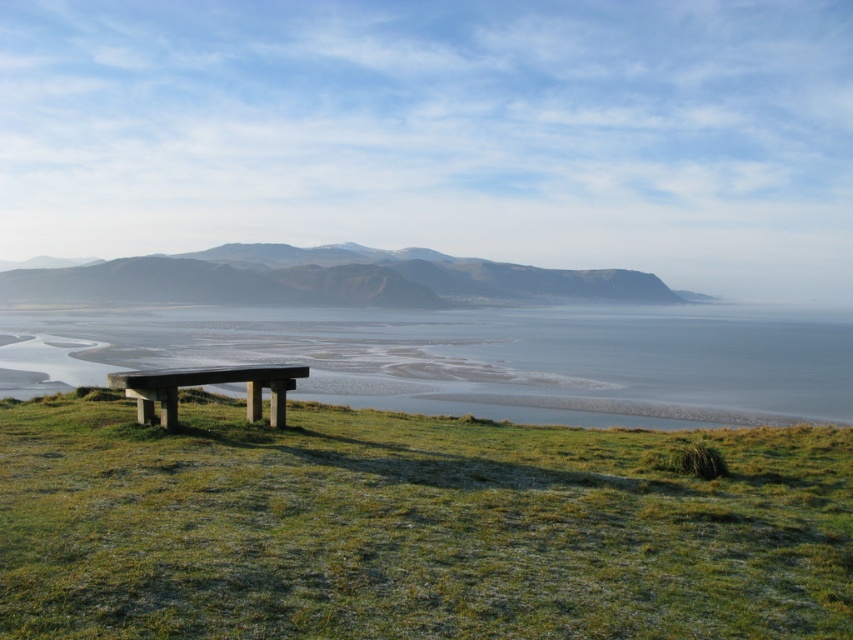
Question: Estimate the real-world distances between objects in this image. Which object is farther from the green grassy hillside at center?

Choices:
 (A) clear water at bench left
 (B) green grassy at lower left
 (C) smooth concrete bench at lower left

Answer: (C)

Question: Among these objects, which one is farthest from the camera?

Choices:
 (A) green grassy hillside at center
 (B) green grassy at lower left
 (C) smooth concrete bench at lower left
 (D) clear water at bench left

Answer: (A)

Question: Is green grassy at lower left thinner than smooth concrete bench at lower left?

Choices:
 (A) no
 (B) yes

Answer: (A)

Question: Does green grassy hillside at center appear over smooth concrete bench at lower left?

Choices:
 (A) yes
 (B) no

Answer: (A)

Question: Among these objects, which one is farthest from the camera?

Choices:
 (A) green grassy at lower left
 (B) clear water at bench left
 (C) green grassy hillside at center

Answer: (C)

Question: Considering the relative positions of green grassy at lower left and clear water at bench left in the image provided, where is green grassy at lower left located with respect to clear water at bench left?

Choices:
 (A) below
 (B) above

Answer: (A)